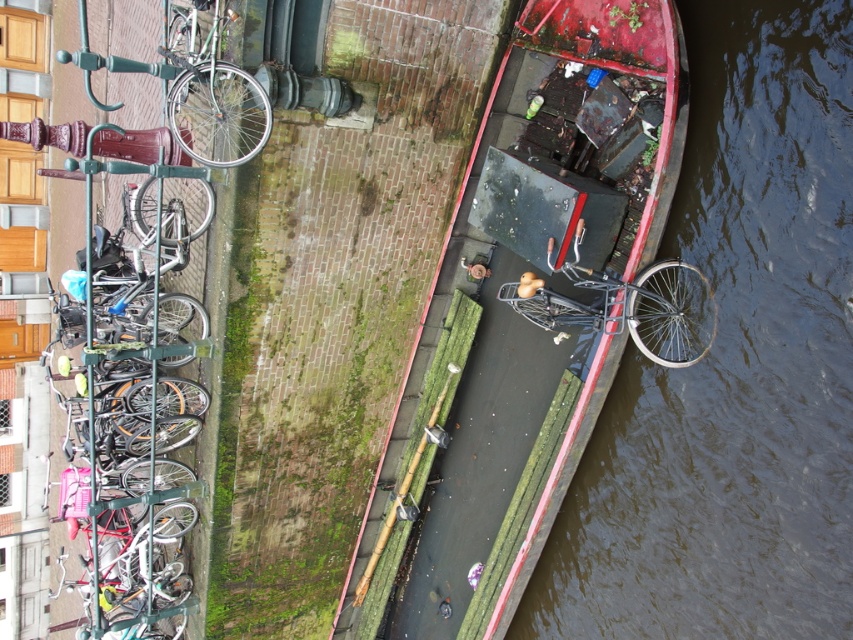
Question: Which of the following is the farthest from the observer?

Choices:
 (A) shiny metallic bicycle at left
 (B) shiny black bicycle at center
 (C) shiny silver bicycle at upper left

Answer: (A)

Question: In this image, where is dark brown water at lower right located relative to shiny silver bicycle at upper left?

Choices:
 (A) below
 (B) above

Answer: (A)

Question: Does dark brown water at lower right lie in front of shiny black bicycle at center?

Choices:
 (A) no
 (B) yes

Answer: (B)

Question: Considering the real-world distances, which object is farthest from the shiny metallic bicycle at left?

Choices:
 (A) rusty metal boat at center
 (B) dark brown water at lower right
 (C) shiny black bicycle at center
 (D) shiny silver bicycle at upper left

Answer: (B)

Question: Among these points, which one is nearest to the camera?

Choices:
 (A) (410, 566)
 (B) (258, 122)
 (C) (517, 611)

Answer: (B)

Question: Can you confirm if dark brown water at lower right is thinner than shiny metallic bicycle at left?

Choices:
 (A) no
 (B) yes

Answer: (A)